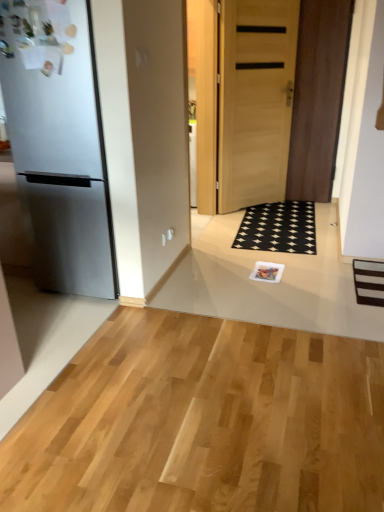
Question: Considering the relative sizes of matte plastic magazine at center and satin black refrigerator at left in the image provided, is matte plastic magazine at center bigger than satin black refrigerator at left?

Choices:
 (A) yes
 (B) no

Answer: (B)

Question: Is matte plastic magazine at center in contact with satin black refrigerator at left?

Choices:
 (A) no
 (B) yes

Answer: (A)

Question: From the image's perspective, does matte plastic magazine at center appear lower than satin black refrigerator at left?

Choices:
 (A) no
 (B) yes

Answer: (B)

Question: Could satin black refrigerator at left be considered to be inside matte plastic magazine at center?

Choices:
 (A) no
 (B) yes

Answer: (A)

Question: From the image's perspective, is matte plastic magazine at center on top of satin black refrigerator at left?

Choices:
 (A) no
 (B) yes

Answer: (A)

Question: Is matte plastic magazine at center outside satin black refrigerator at left?

Choices:
 (A) yes
 (B) no

Answer: (A)

Question: Would you consider black rubber doormat at center to be distant from matte plastic magazine at center?

Choices:
 (A) no
 (B) yes

Answer: (A)

Question: From a real-world perspective, is black rubber doormat at center located beneath matte plastic magazine at center?

Choices:
 (A) yes
 (B) no

Answer: (A)

Question: Is black rubber doormat at center placed right next to matte plastic magazine at center?

Choices:
 (A) no
 (B) yes

Answer: (A)

Question: Considering the relative sizes of black rubber doormat at center and matte plastic magazine at center in the image provided, is black rubber doormat at center thinner than matte plastic magazine at center?

Choices:
 (A) no
 (B) yes

Answer: (A)

Question: From the image's perspective, would you say black rubber doormat at center is shown under matte plastic magazine at center?

Choices:
 (A) no
 (B) yes

Answer: (A)

Question: Does black rubber doormat at center have a smaller size compared to matte plastic magazine at center?

Choices:
 (A) no
 (B) yes

Answer: (A)

Question: Does matte plastic magazine at center appear on the left side of light brown wood door at center, positioned as the 2th door in left-to-right order?

Choices:
 (A) yes
 (B) no

Answer: (A)